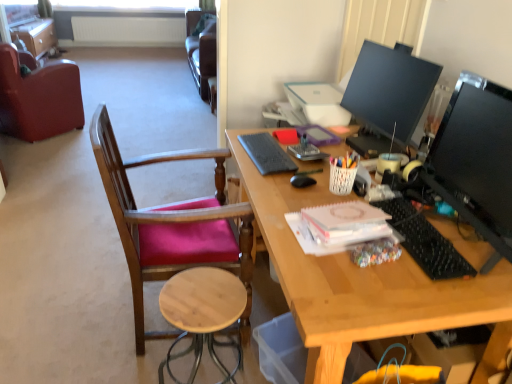
The height and width of the screenshot is (384, 512). What are the coordinates of `vacant area on top of black plastic keyboard at right (from a real-world perspective)` in the screenshot? It's located at (419, 233).